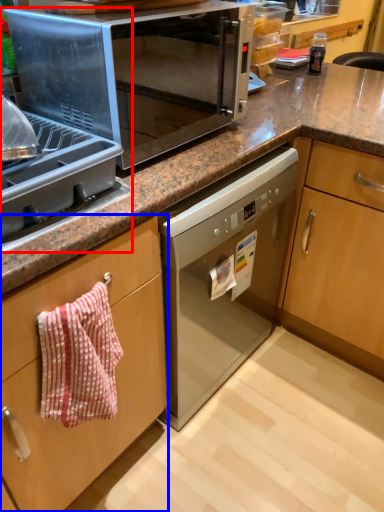
Question: Which object appears closest to the camera in this image, appliance (highlighted by a red box) or cabinetry (highlighted by a blue box)?

Choices:
 (A) appliance
 (B) cabinetry

Answer: (A)